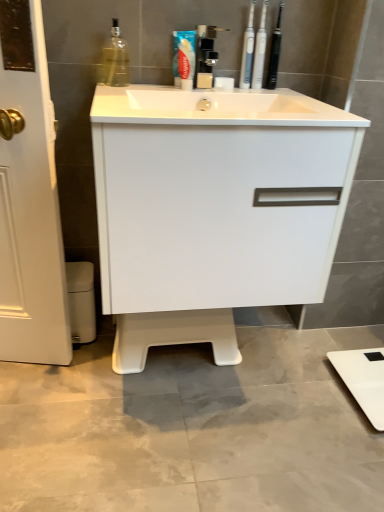
You are a GUI agent. You are given a task and a screenshot of the screen. Output one action in this format:
    pyautogui.click(x=<x>, y=<y>)
    Task: Click on the free space in front of black plastic toothbrushes at upper center, which is the 3th toiletry from left to right
    
    Given the screenshot: What is the action you would take?
    pyautogui.click(x=278, y=94)